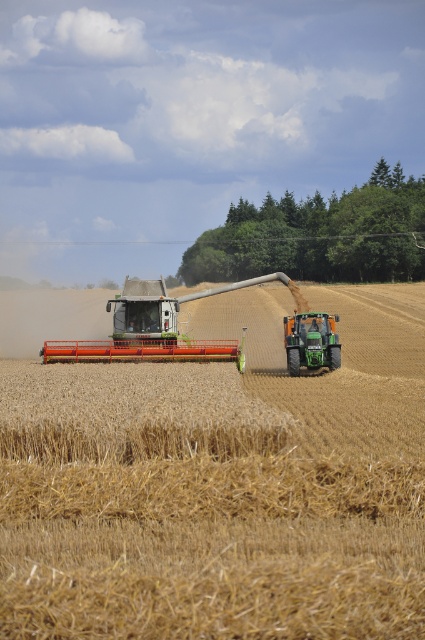
You are a farmer planning to plant a new crop in the golden straw field at center. The orange metallic plow at center is available for tilling. Considering their sizes, which object would require more space to operate the plow effectively?

The golden straw field at center has a larger size compared to the orange metallic plow at center, so the plow would require more space to operate effectively in the larger field.